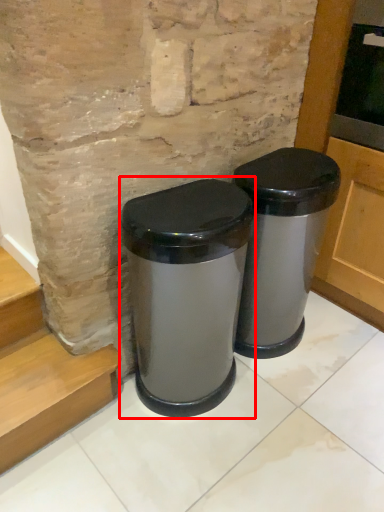
Question: From the image, what is the correct spatial relationship of waste container (annotated by the red box) in relation to waste container?

Choices:
 (A) left
 (B) right

Answer: (A)